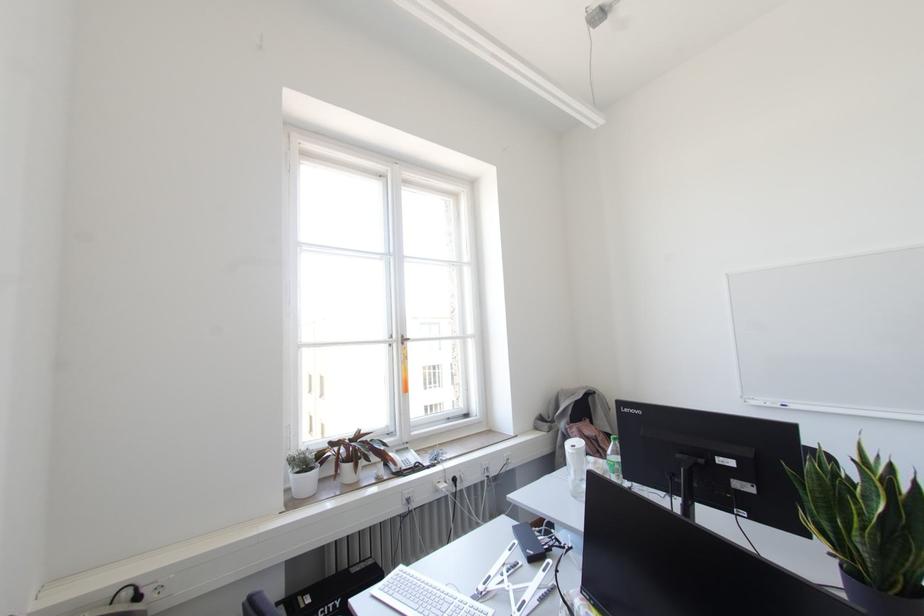
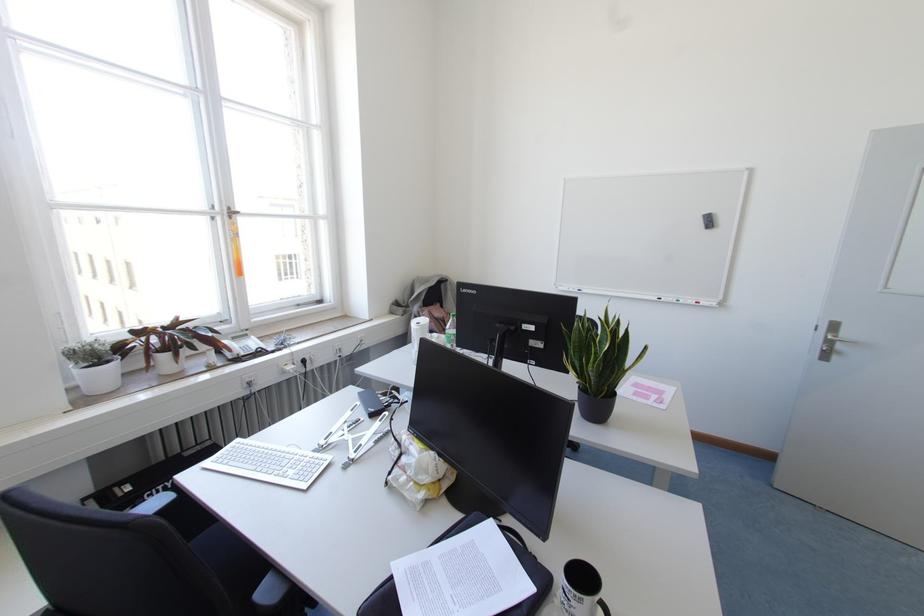
In the second image, find the point that corresponds to (x=578, y=446) in the first image.

(423, 323)